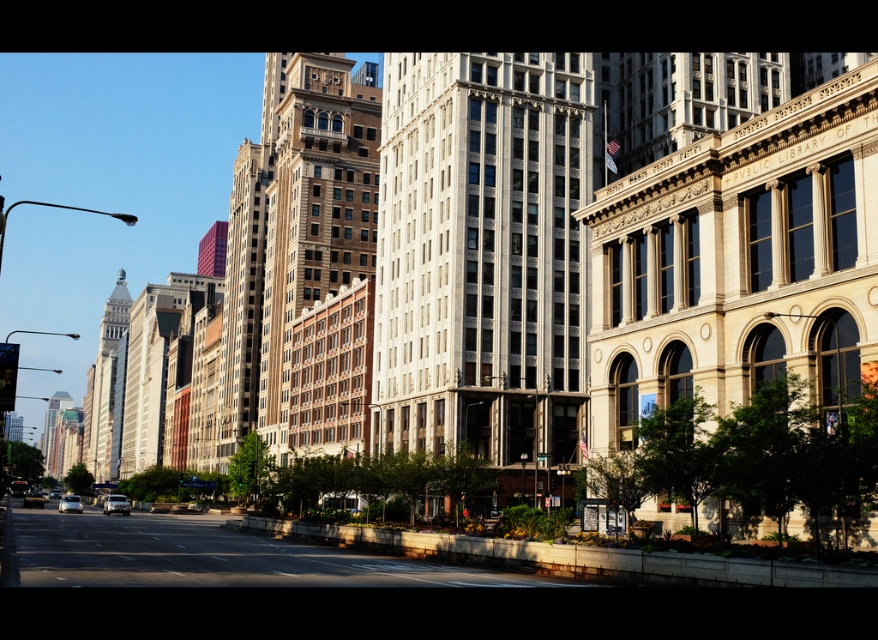
Looking at this image, you are a pedestrian standing at the center of the image. You see a metallic silver sedan at lower left and a shiny silver car at lower left. Which one is closer to the right side of the image?

The metallic silver sedan at lower left is to the right of the shiny silver car at lower left, so the metallic silver sedan at lower left is closer to the right side of the image.

You are a delivery person trying to park your shiny silver car at lower left in a tight space near the PUBLIC LIBRARY OF building. There is another silver metallic car at lower left already occupying part of the spot. Can you fit your car into the remaining space?

The silver metallic car at lower left is positioned over shiny silver car at lower left, meaning there is no remaining space for the shiny silver car to fit into the spot.

Based on the photo, you are a pedestrian standing at the center of the image. You see a metallic silver sedan at lower left and a shiny silver car at lower left. Which one is closer to you?

The metallic silver sedan at lower left is positioned over the shiny silver car at lower left, so the metallic silver sedan at lower left is closer to you.